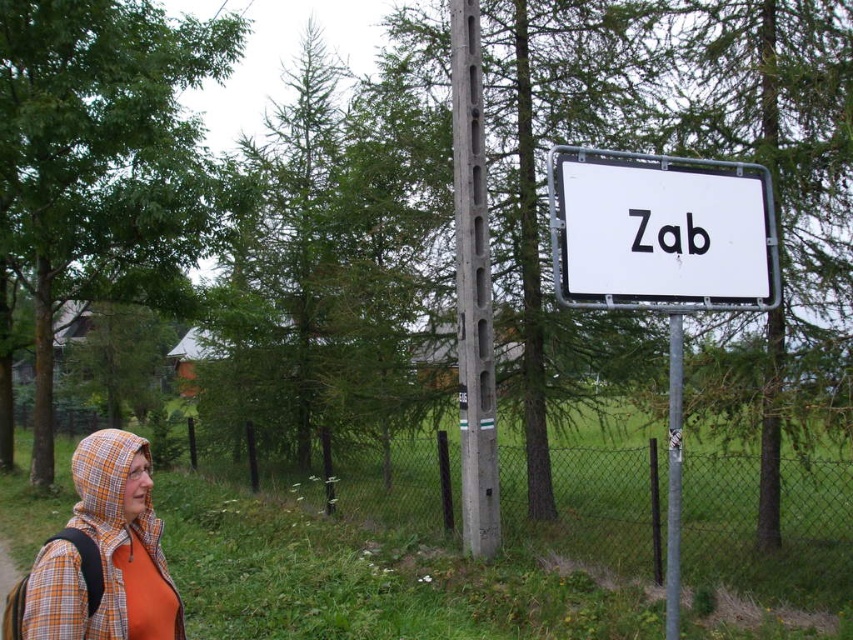
You are a hiker who has just arrived at a trailhead and see the white plastic sign at center and the orange plaid hood at left. Which object is higher in the image?

The white plastic sign at center is located above the orange plaid hood at left, so it is higher in the image.

You are a delivery drone that needs to deliver a package to the white plastic sign at center. Your current position is near the orange plaid hood at left. Can you fly directly to the sign without any obstacles between you and the sign?

The distance between the white plastic sign at center and the orange plaid hood at left is 2.09 meters. Since there are no mentioned obstacles in the scene description, the drone can fly directly to the sign.